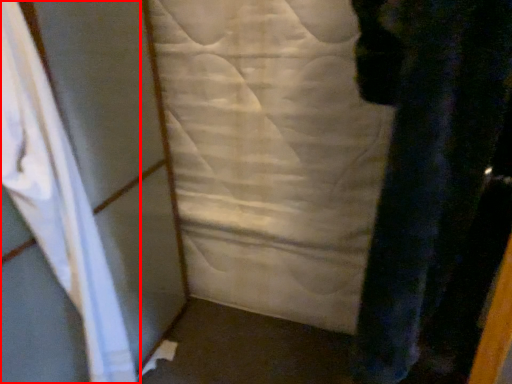
Question: In this image, where is curtain (annotated by the red box) located relative to sheet?

Choices:
 (A) left
 (B) right

Answer: (A)